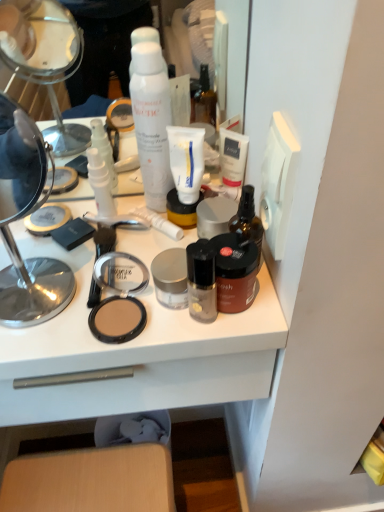
Question: Is transparent plastic bottles at center, which is counted as the 5th toiletry, starting from the right, to the right of white matte shaving cream at center from the viewer's perspective?

Choices:
 (A) yes
 (B) no

Answer: (B)

Question: Does transparent plastic bottles at center, positioned as the first toiletry in left-to-right order, lie behind white matte shaving cream at center?

Choices:
 (A) yes
 (B) no

Answer: (A)

Question: Is transparent plastic bottles at center, positioned as the first toiletry in left-to-right order, oriented towards white matte shaving cream at center?

Choices:
 (A) no
 (B) yes

Answer: (A)

Question: Can you see transparent plastic bottles at center, positioned as the first toiletry in left-to-right order, touching white matte shaving cream at center?

Choices:
 (A) yes
 (B) no

Answer: (B)

Question: From the image's perspective, is transparent plastic bottles at center, which is counted as the 5th toiletry, starting from the right, above white matte shaving cream at center?

Choices:
 (A) yes
 (B) no

Answer: (B)

Question: Considering the positions of white matte shaving cream at center and satin black foundation at center, the fourth toiletry from the left, in the image, is white matte shaving cream at center taller or shorter than satin black foundation at center, the fourth toiletry from the left,?

Choices:
 (A) tall
 (B) short

Answer: (A)

Question: Is white matte shaving cream at center situated inside satin black foundation at center, the fourth toiletry from the left, or outside?

Choices:
 (A) outside
 (B) inside

Answer: (A)

Question: Does point (163, 114) appear closer or farther from the camera than point (205, 290)?

Choices:
 (A) closer
 (B) farther

Answer: (B)

Question: From the image's perspective, is white matte shaving cream at center above or below satin black foundation at center, placed as the 2th toiletry when sorted from right to left?

Choices:
 (A) below
 (B) above

Answer: (B)

Question: From their relative heights in the image, would you say brown matte jar at center, which ranks as the first toiletry in right-to-left order, is taller or shorter than white plastic tube at center, the fourth toiletry positioned from the right?

Choices:
 (A) tall
 (B) short

Answer: (A)

Question: Considering the positions of point (249, 245) and point (139, 209), is point (249, 245) closer or farther from the camera than point (139, 209)?

Choices:
 (A) closer
 (B) farther

Answer: (A)

Question: Looking at the image, does brown matte jar at center, which ranks as the 5th toiletry in left-to-right order, seem bigger or smaller compared to white plastic tube at center, the fourth toiletry positioned from the right?

Choices:
 (A) small
 (B) big

Answer: (B)

Question: Which is correct: brown matte jar at center, which ranks as the first toiletry in right-to-left order, is inside white plastic tube at center, which appears as the second toiletry when viewed from the left, or outside of it?

Choices:
 (A) outside
 (B) inside

Answer: (A)

Question: In the image, is brown matte jar at center, which ranks as the 5th toiletry in left-to-right order, positioned in front of or behind satin black foundation at center, the fourth toiletry from the left?

Choices:
 (A) behind
 (B) front

Answer: (A)

Question: Is brown matte jar at center, which ranks as the first toiletry in right-to-left order, spatially inside satin black foundation at center, placed as the 2th toiletry when sorted from right to left, or outside of it?

Choices:
 (A) inside
 (B) outside

Answer: (B)